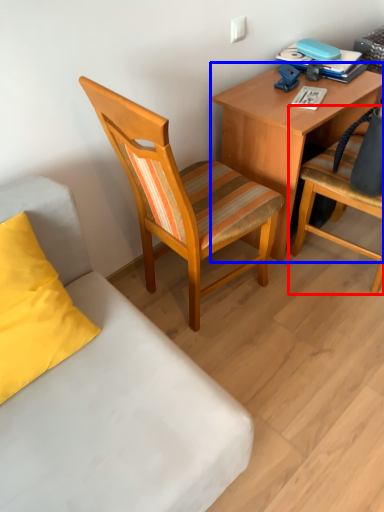
Question: Which point is further to the camera, chair (highlighted by a red box) or desk (highlighted by a blue box)?

Choices:
 (A) chair
 (B) desk

Answer: (B)